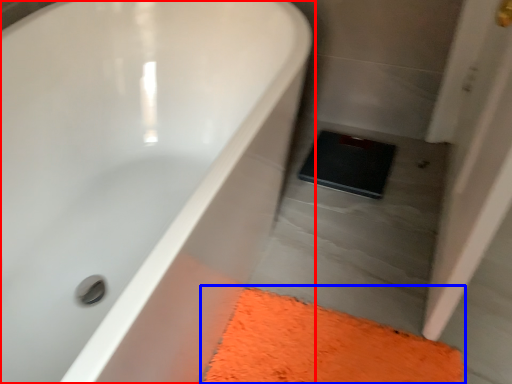
Question: Among these objects, which one is nearest to the camera, bathtub (highlighted by a red box) or bath mat (highlighted by a blue box)?

Choices:
 (A) bathtub
 (B) bath mat

Answer: (A)